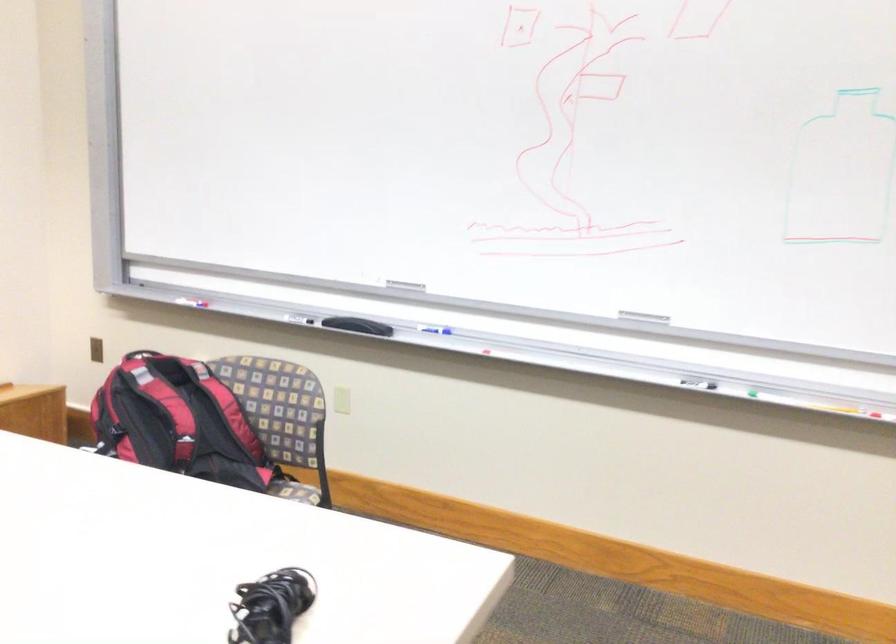
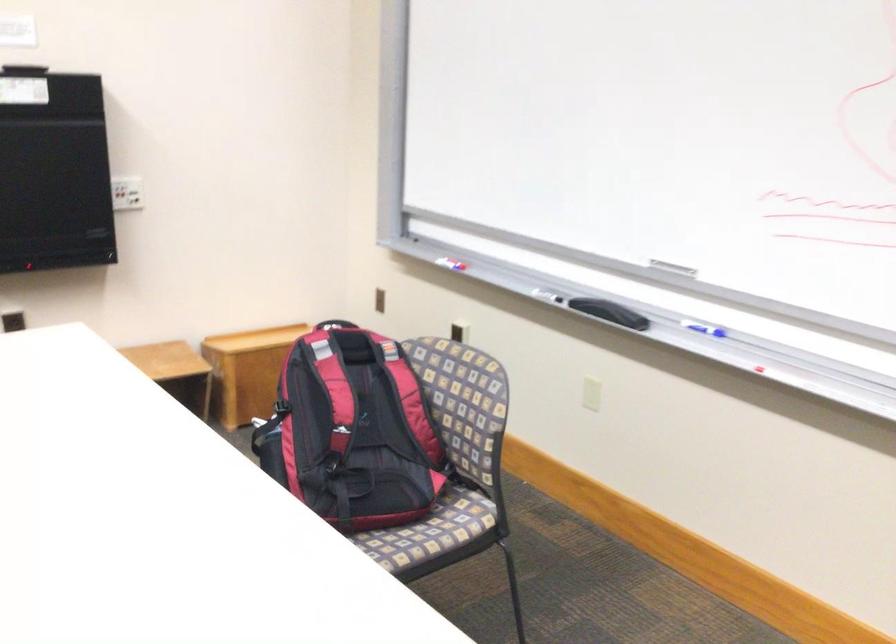
Find the pixel in the second image that matches point 174,409 in the first image.

(334, 391)